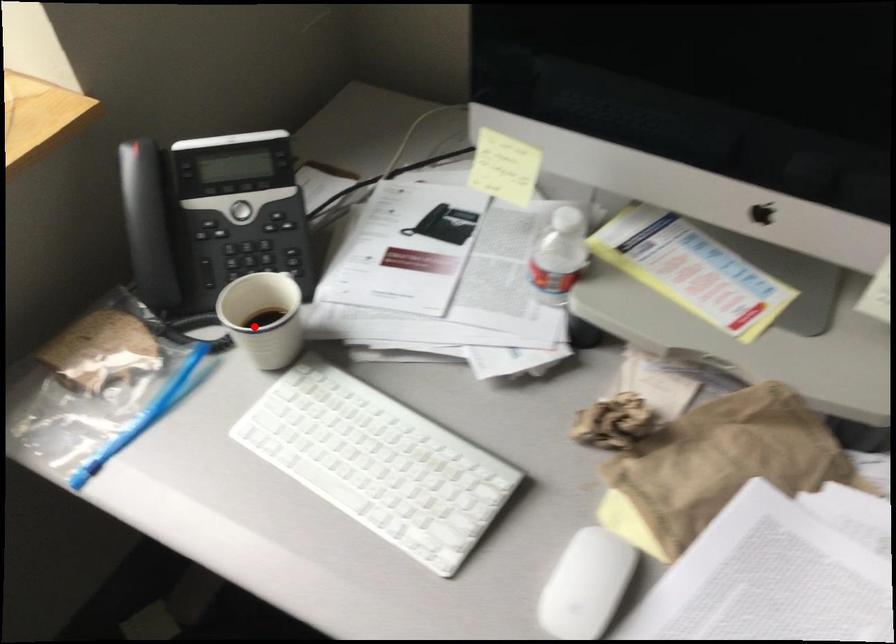
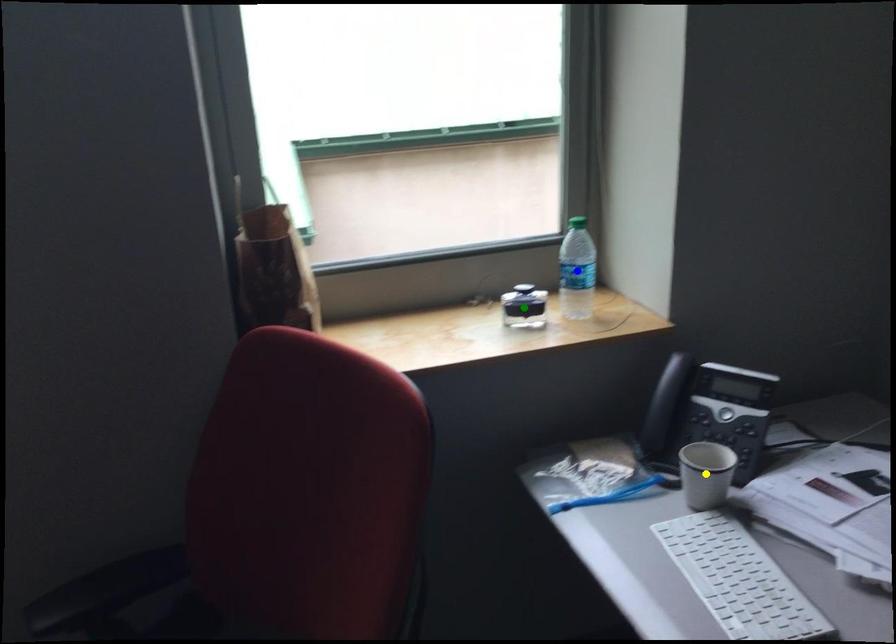
Question: I am providing you with two images of the same scene from different viewpoints. A red point is marked on the first image. You are given multiple points on the second image. Which spot in image 2 lines up with the point in image 1?

Choices:
 (A) blue point
 (B) green point
 (C) yellow point

Answer: (C)